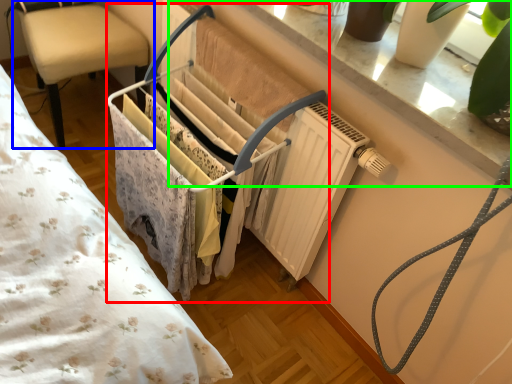
Question: Based on their relative distances, which object is farther from closet (highlighted by a red box)? Choose from chair (highlighted by a blue box) and window sill (highlighted by a green box).

Choices:
 (A) chair
 (B) window sill

Answer: (A)